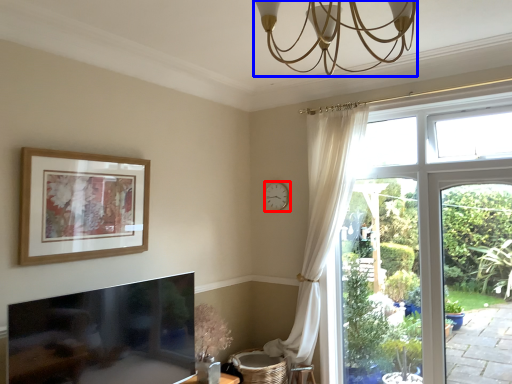
Question: Which object is closer to the camera taking this photo, clock (highlighted by a red box) or light fixture (highlighted by a blue box)?

Choices:
 (A) clock
 (B) light fixture

Answer: (B)